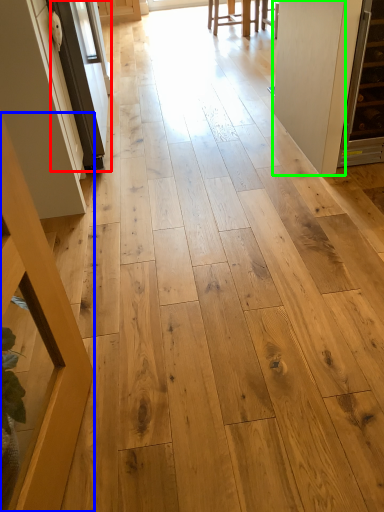
Question: Considering the real-world distances, which object is closest to screen door (highlighted by a red box)? furniture (highlighted by a blue box) or door (highlighted by a green box).

Choices:
 (A) furniture
 (B) door

Answer: (B)